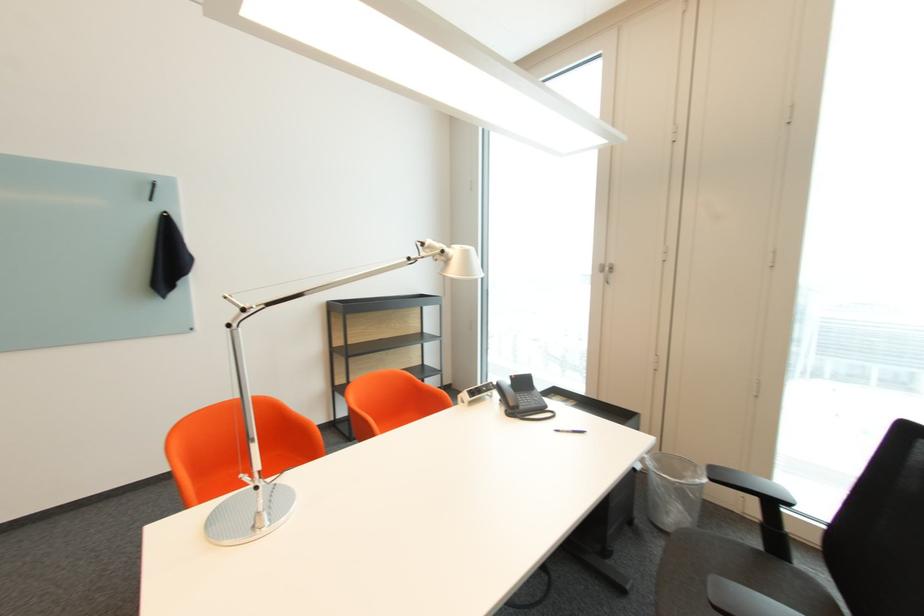
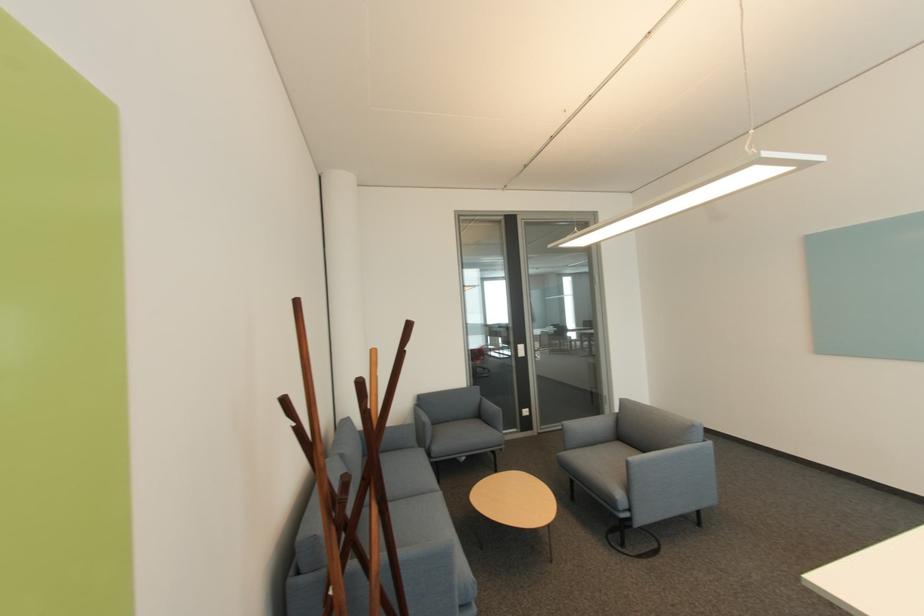
Question: The images are taken continuously from a first-person perspective. In which direction is your viewpoint rotating?

Choices:
 (A) Left
 (B) Right
 (C) Up
 (D) Down

Answer: (A)